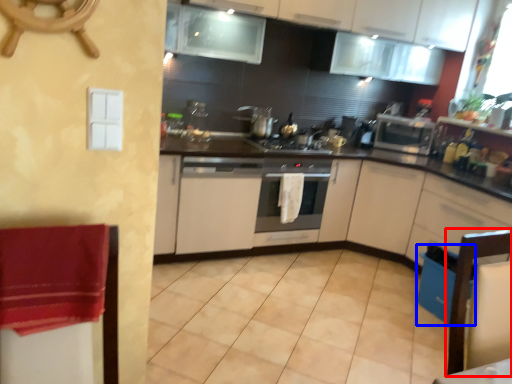
Question: Among these objects, which one is nearest to the camera, chair (highlighted by a red box) or dish washer (highlighted by a blue box)?

Choices:
 (A) chair
 (B) dish washer

Answer: (A)